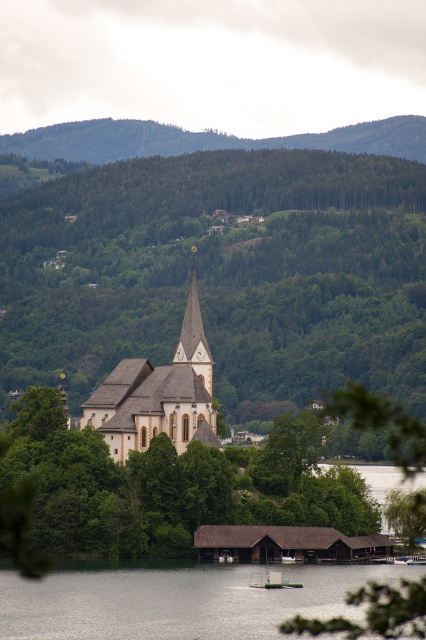
You are a painter standing at the edge of the lake, wanting to capture the scene in front of you. You notice the green leafy tree at center and the white stone church at center. Which object is wider in your view?

The green leafy tree at center is wider than the white stone church at center according to the description.

You are a landscape photographer planning to capture the church and its surroundings. You want to ensure that the transparent water at lower center and the green forested hillside at upper center are both visible in your shot. Given their widths, which object should you focus on to frame the shot properly?

The transparent water at lower center has a smaller width compared to the green forested hillside at upper center. To frame the shot properly, focus on the green forested hillside at upper center since it occupies more space in the image.